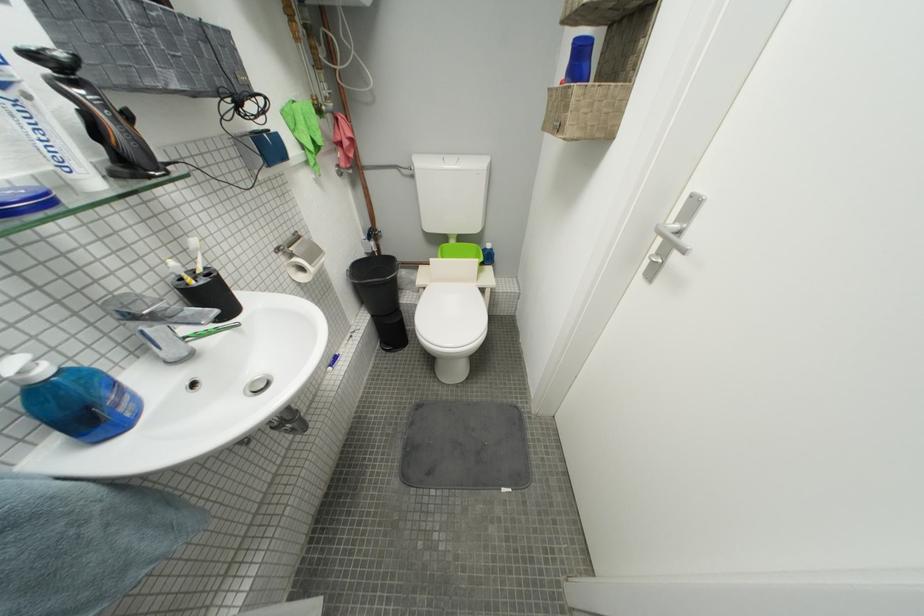
What are the coordinates of `blue round lid` in the screenshot? It's located at (26, 200).